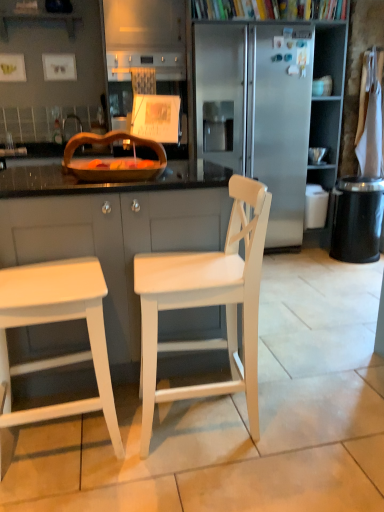
Question: Is white wood cabinet at center at the back of black textured trash can at right?

Choices:
 (A) no
 (B) yes

Answer: (A)

Question: From the image's perspective, is black textured trash can at right under white wood cabinet at center?

Choices:
 (A) no
 (B) yes

Answer: (A)

Question: Could you tell me if black textured trash can at right is facing white wood cabinet at center?

Choices:
 (A) yes
 (B) no

Answer: (B)

Question: Considering the relative sizes of black textured trash can at right and white wood cabinet at center in the image provided, is black textured trash can at right wider than white wood cabinet at center?

Choices:
 (A) yes
 (B) no

Answer: (B)

Question: Is black textured trash can at right to the right of white wood cabinet at center from the viewer's perspective?

Choices:
 (A) no
 (B) yes

Answer: (B)

Question: Is white wood cabinet at center inside black textured trash can at right?

Choices:
 (A) no
 (B) yes

Answer: (A)

Question: Would you say wooden tray at center contains white matte stool at left?

Choices:
 (A) no
 (B) yes

Answer: (A)

Question: From a real-world perspective, is wooden tray at center on white matte stool at left?

Choices:
 (A) no
 (B) yes

Answer: (B)

Question: Does wooden tray at center have a lesser width compared to white matte stool at left?

Choices:
 (A) yes
 (B) no

Answer: (A)

Question: Is wooden tray at center not near white matte stool at left?

Choices:
 (A) no
 (B) yes

Answer: (A)

Question: Does wooden tray at center appear on the left side of white matte stool at left?

Choices:
 (A) yes
 (B) no

Answer: (B)

Question: Is wooden tray at center next to white matte stool at left and touching it?

Choices:
 (A) yes
 (B) no

Answer: (B)

Question: Considering the relative sizes of stainless steel refrigerator at center and wooden tray at center in the image provided, is stainless steel refrigerator at center wider than wooden tray at center?

Choices:
 (A) yes
 (B) no

Answer: (A)